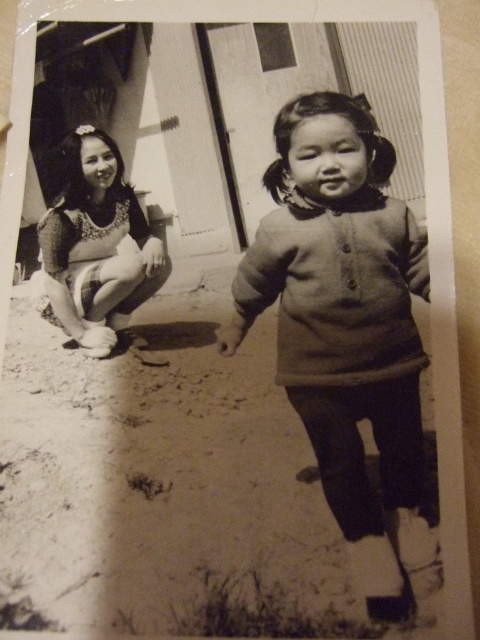
You are a photographer trying to capture a clear shot of the matte gray sweater at center and the dull sand at lower center. Which object will appear larger in the photo due to its proximity to the camera?

The dull sand at lower center will appear larger in the photo because it is closer to the viewer than the matte gray sweater at center.

You are standing at the point with coordinates point (x=162, y=483). What is the material under your feet?

The material under your feet at point (x=162, y=483) is dull sand at lower center.

You are a photographer trying to capture a clear shot of both the matte gray sweater at center and the matte floral dress at left. Based on their positions in the image, which one is closer to the camera?

The matte gray sweater at center is closer to the camera because it is positioned below the matte floral dress at left, indicating it is in the foreground.